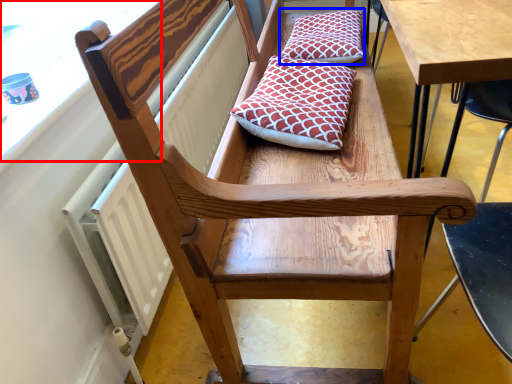
Question: Which object appears closest to the camera in this image, window screen (highlighted by a red box) or pillow (highlighted by a blue box)?

Choices:
 (A) window screen
 (B) pillow

Answer: (A)